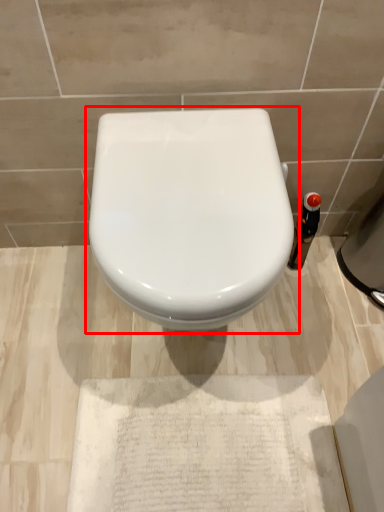
Question: From the image's perspective, what is the correct spatial relationship of toilet (annotated by the red box) in relation to bottle?

Choices:
 (A) below
 (B) above

Answer: (A)